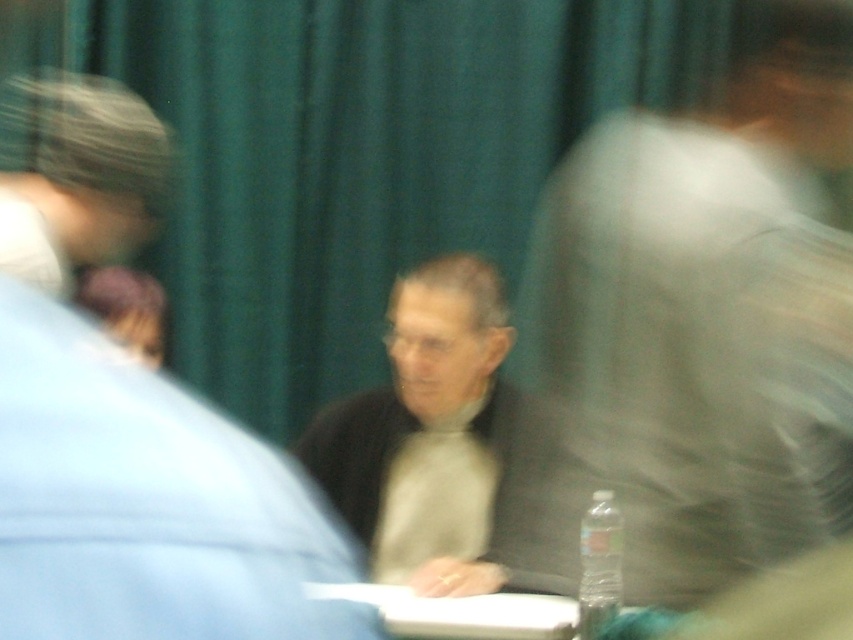
Question: Does gray wool sweater at center appear over clear plastic bottle at center?

Choices:
 (A) no
 (B) yes

Answer: (B)

Question: Can you confirm if green fabric curtain at center is positioned below light gray sweater at center?

Choices:
 (A) yes
 (B) no

Answer: (B)

Question: Which object is closer to the camera taking this photo?

Choices:
 (A) clear plastic bottle at center
 (B) light gray sweater at center

Answer: (B)

Question: Which object appears farthest from the camera in this image?

Choices:
 (A) white plastic table at center
 (B) gray wool sweater at center
 (C) matte black jacket at upper left
 (D) clear plastic bottle at center

Answer: (B)

Question: Does matte black jacket at upper left have a smaller size compared to white plastic table at center?

Choices:
 (A) no
 (B) yes

Answer: (A)

Question: Which is farther from the green fabric curtain at center?

Choices:
 (A) matte black jacket at upper left
 (B) white plastic table at center
 (C) light gray sweater at center
 (D) clear plastic bottle at center

Answer: (D)